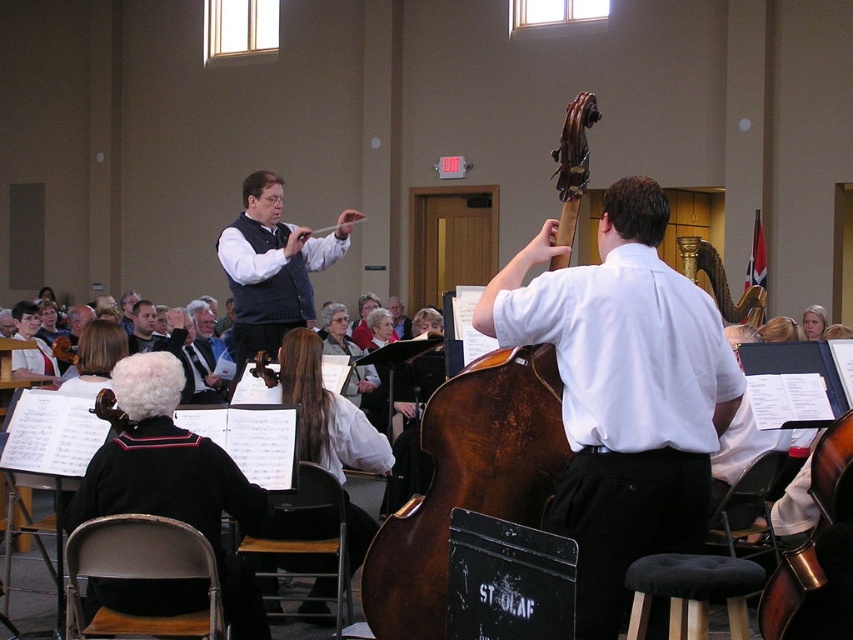
You are a photographer standing in the room and want to take a closeup photo of the dark brown wood cello at center. Considering the distance, is it possible to capture the cello in focus without moving closer?

The dark brown wood cello at center is 28.47 feet away from camera. At this distance, capturing a closeup photo would require a telephoto lens to maintain focus and clarity without moving closer.

You are standing in the center of the room and want to move towards the dark brown wood cello at center. According to the coordinates provided, in which direction should you move?

The dark brown wood cello at center is located at coordinates point (466, 481), so you should move towards the right direction to reach it.